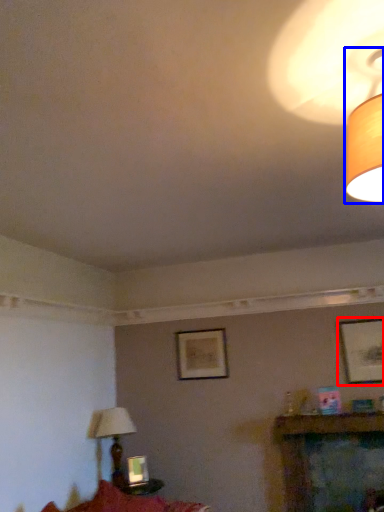
Question: Which point is closer to the camera, picture frame (highlighted by a red box) or lamp (highlighted by a blue box)?

Choices:
 (A) picture frame
 (B) lamp

Answer: (B)